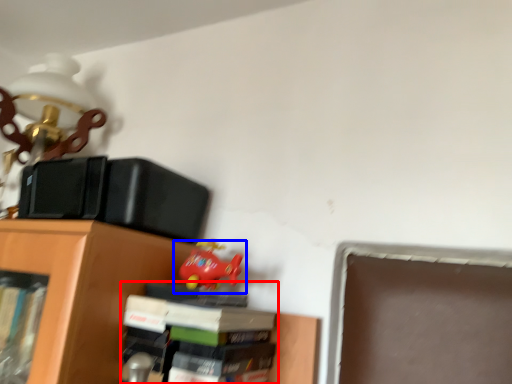
Question: Which object is closer to the camera taking this photo, book (highlighted by a red box) or toy (highlighted by a blue box)?

Choices:
 (A) book
 (B) toy

Answer: (A)